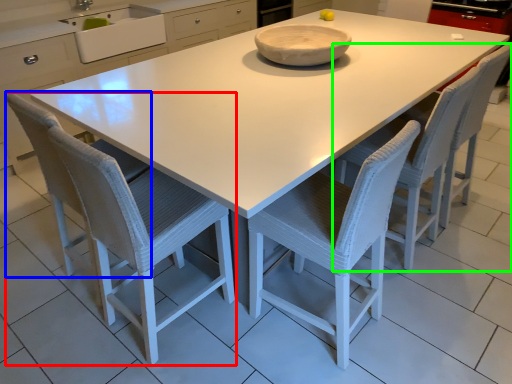
Question: Based on their relative distances, which object is nearer to chair (highlighted by a red box)? Choose from swivel chair (highlighted by a blue box) and chair (highlighted by a green box).

Choices:
 (A) swivel chair
 (B) chair

Answer: (A)